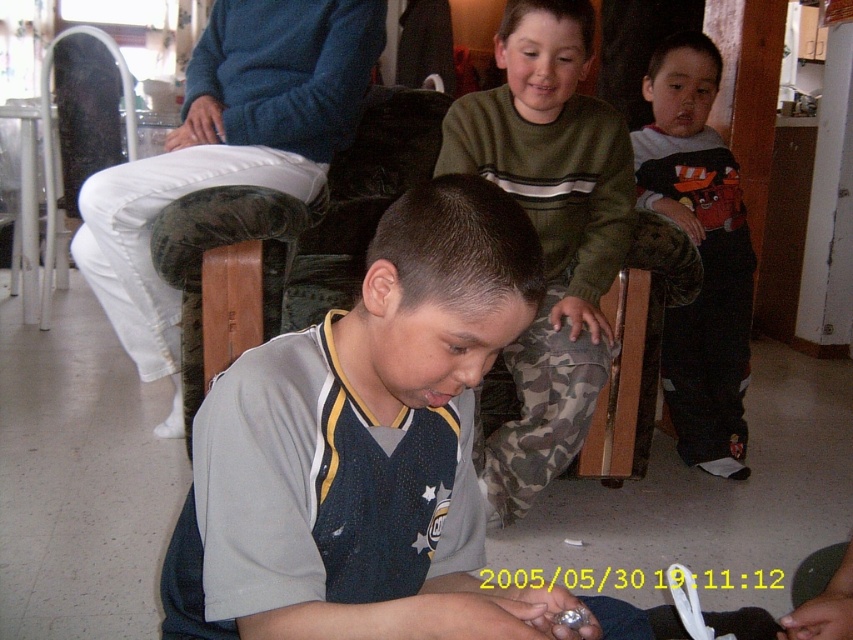
You are a parent trying to organize your childrens clothing. You have a gray mesh shirt at center and a green sweater at upper center. If you want to place them in a drawer that is 30 inches wide, will they fit side by side?

The gray mesh shirt at center is 32.38 inches from green sweater at upper center, so placing them side by side in a 30 inch wide drawer would not fit since the combined width exceeds the drawer space.

You are standing in the room and want to reach the point at coordinates [285,458]. If you can move 1 meter forward, will you be able to reach that point?

The distance between you and the point at coordinates [285,458] is 81.15 centimeters. Since you can move 1 meter forward, which is longer than 81.15 centimeters, you will be able to reach the point.

Looking at the scene, where is the gray mesh shirt at center in relation to the blue fleece sweater at upper center?

The gray mesh shirt at center is to the right of the blue fleece sweater at upper center.